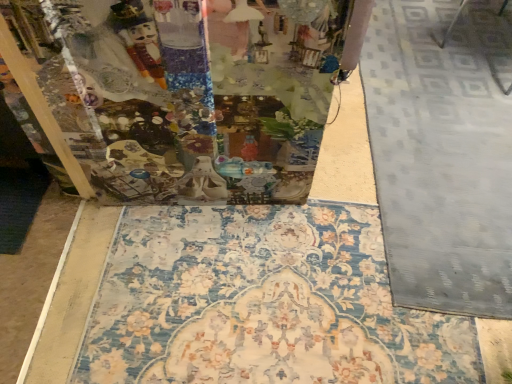
Image resolution: width=512 pixels, height=384 pixels. I want to click on free region under gray textured rug at right (from a real-world perspective), so (x=446, y=85).